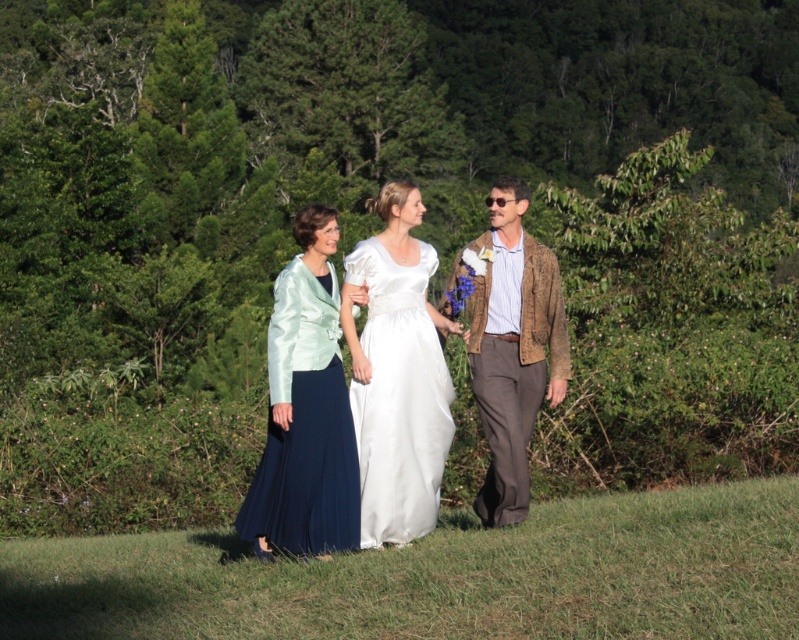
Between point (309, 600) and point (407, 337), which one is positioned behind?

Point (407, 337)

Who is positioned more to the left, green grass at lower center or satin white dress at center?

satin white dress at center is more to the left.

Who is more distant from viewer, (388, 552) or (408, 476)?

The point (408, 476) is more distant.

You are a GUI agent. You are given a task and a screenshot of the screen. Output one action in this format:
    pyautogui.click(x=<x>, y=<y>)
    Task: Click on the green grass at lower center
    This screenshot has width=799, height=640.
    Given the screenshot: What is the action you would take?
    pyautogui.click(x=440, y=577)

Between point (578, 531) and point (507, 458), which one is positioned in front?

Point (578, 531)

Locate an element on the screen. This screenshot has width=799, height=640. green grass at lower center is located at coordinates (440, 577).

Does green grass at lower center have a larger size compared to white satin dress at center?

No.

Between point (233, 595) and point (382, 310), which one is positioned in front?

Point (233, 595)

Locate an element on the screen. green grass at lower center is located at coordinates (440, 577).